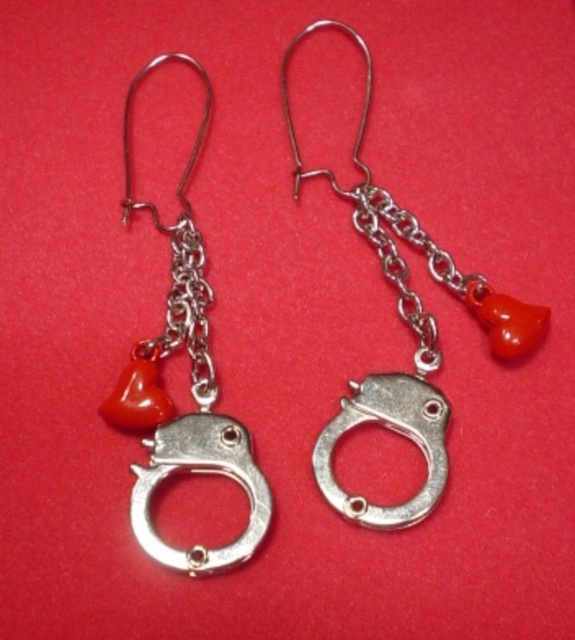
You are an appraiser trying to determine the exact location of the silver metallic handcuff at center in the image. Based on the coordinates provided, can you confirm its position relative to the center of the image?

The silver metallic handcuff at center is located at coordinates point (409,326), which is slightly to the right and below the exact center of the image.

You are an earring designer analyzing the placement of two points on a pair of earrings. The points are labeled as point 1 at coordinates (365, 92) and point 2 at (139, 481). Based on the design, which point is closer to the front of the earring?

Point 2 at coordinates (139, 481) is closer to the front of the earring because the description states that point 1 is behind point 2.